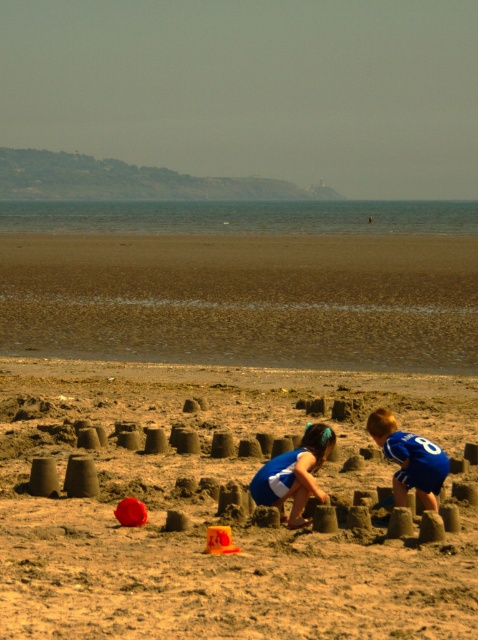
You are a drone operator trying to locate a specific point on the beach. According to the image, where exactly is the point labeled as point (x=221, y=509)?

The point (x=221, y=509) is located on the brown sandy beach at center.

You are a photographer trying to capture a photo of the brown sandy beach at lower center and the blue jersey at lower right. From your current position, which object is located to the left?

The brown sandy beach at lower center is positioned on the left side of the blue jersey at lower right, so the brown sandy beach at lower center is to the left.